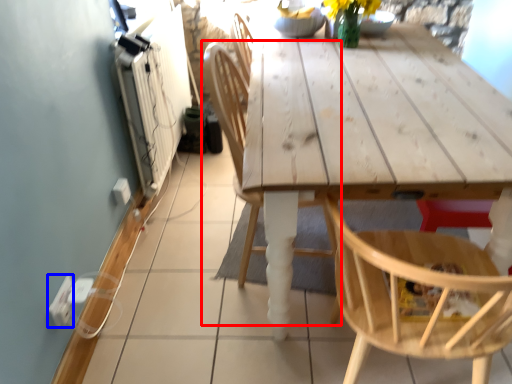
Question: Which of the following is the closest to the observer, chair (highlighted by a red box) or electric outlet (highlighted by a blue box)?

Choices:
 (A) chair
 (B) electric outlet

Answer: (A)